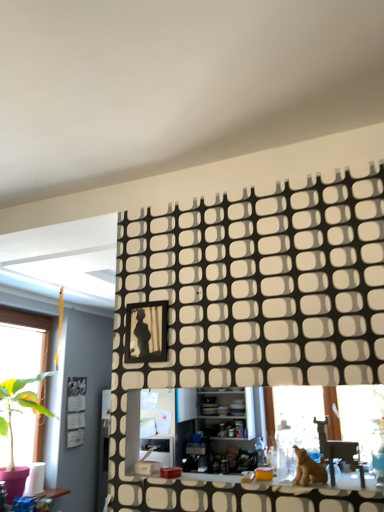
Question: Is black textured wall panel at upper center in front of or behind metallic silver swivel chair at lower right in the image?

Choices:
 (A) front
 (B) behind

Answer: (A)

Question: Is black textured wall panel at upper center inside the boundaries of metallic silver swivel chair at lower right, or outside?

Choices:
 (A) outside
 (B) inside

Answer: (A)

Question: Considering the real-world distances, which object is farthest from the black textured wall panel at upper center?

Choices:
 (A) metallic silver swivel chair at lower right
 (B) white glossy counter top at center
 (C) matte black picture frame at center
 (D) brown furry dog at lower right

Answer: (B)

Question: Which object is positioned closest to the white glossy counter top at center?

Choices:
 (A) matte black picture frame at center
 (B) black textured wall panel at upper center
 (C) metallic silver swivel chair at lower right
 (D) brown furry dog at lower right

Answer: (D)